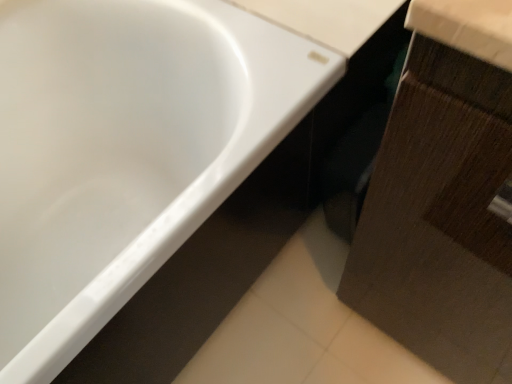
Question: Is white glossy bathtub at upper left thinner than brown wood cabinet at lower right?

Choices:
 (A) yes
 (B) no

Answer: (B)

Question: Could you tell me if white glossy bathtub at upper left is facing brown wood cabinet at lower right?

Choices:
 (A) no
 (B) yes

Answer: (B)

Question: Does white glossy bathtub at upper left have a greater height compared to brown wood cabinet at lower right?

Choices:
 (A) no
 (B) yes

Answer: (A)

Question: From a real-world perspective, is white glossy bathtub at upper left physically above brown wood cabinet at lower right?

Choices:
 (A) no
 (B) yes

Answer: (A)

Question: Is the surface of white glossy bathtub at upper left in direct contact with brown wood cabinet at lower right?

Choices:
 (A) yes
 (B) no

Answer: (B)

Question: Is white glossy bathtub at upper left at the right side of brown wood cabinet at lower right?

Choices:
 (A) no
 (B) yes

Answer: (A)

Question: Is the depth of brown wood cabinet at lower right less than that of white glossy bathtub at upper left?

Choices:
 (A) no
 (B) yes

Answer: (B)

Question: Is white glossy bathtub at upper left at the back of brown wood cabinet at lower right?

Choices:
 (A) yes
 (B) no

Answer: (B)

Question: Does brown wood cabinet at lower right have a lesser height compared to white glossy bathtub at upper left?

Choices:
 (A) no
 (B) yes

Answer: (A)

Question: Does brown wood cabinet at lower right have a larger size compared to white glossy bathtub at upper left?

Choices:
 (A) yes
 (B) no

Answer: (B)

Question: Is white glossy bathtub at upper left located within brown wood cabinet at lower right?

Choices:
 (A) yes
 (B) no

Answer: (B)

Question: From a real-world perspective, is brown wood cabinet at lower right located beneath white glossy bathtub at upper left?

Choices:
 (A) yes
 (B) no

Answer: (B)

Question: Is brown wood cabinet at lower right inside the boundaries of white glossy bathtub at upper left, or outside?

Choices:
 (A) outside
 (B) inside

Answer: (A)